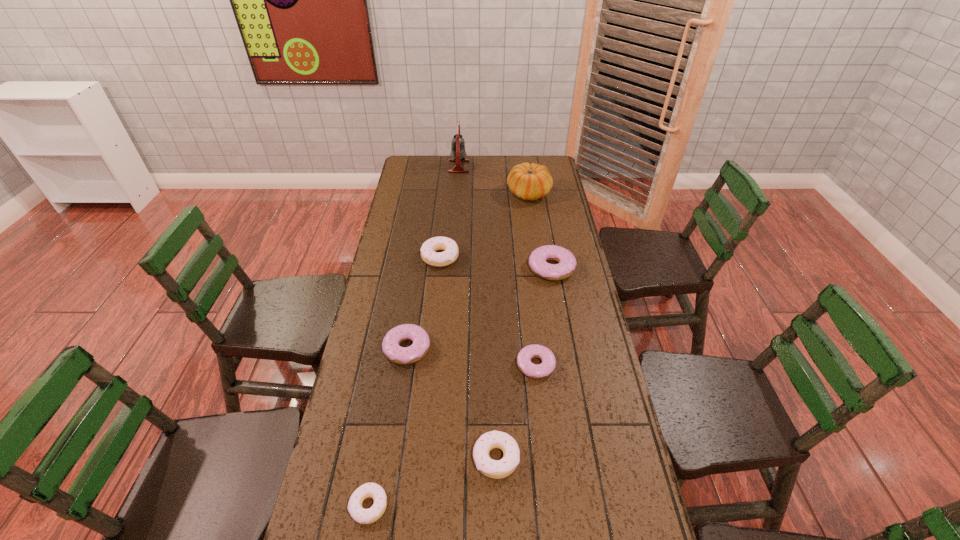
Where is `vacant area that satisfies the following two spatial constraints: 1. on the front side of the smallest pink doughnut; 2. on the right side of the farthest white doughnut`? vacant area that satisfies the following two spatial constraints: 1. on the front side of the smallest pink doughnut; 2. on the right side of the farthest white doughnut is located at coordinates (429, 364).

This screenshot has height=540, width=960. I want to click on free space in the image that satisfies the following two spatial constraints: 1. on the front side of the bell; 2. on the right side of the smallest pink doughnut, so click(444, 364).

You are a GUI agent. You are given a task and a screenshot of the screen. Output one action in this format:
    pyautogui.click(x=<x>, y=<y>)
    Task: Click on the vacant area that satisfies the following two spatial constraints: 1. on the back side of the smallest pink doughnut; 2. on the right side of the nearest object
    This screenshot has width=960, height=540.
    Given the screenshot: What is the action you would take?
    pyautogui.click(x=394, y=364)